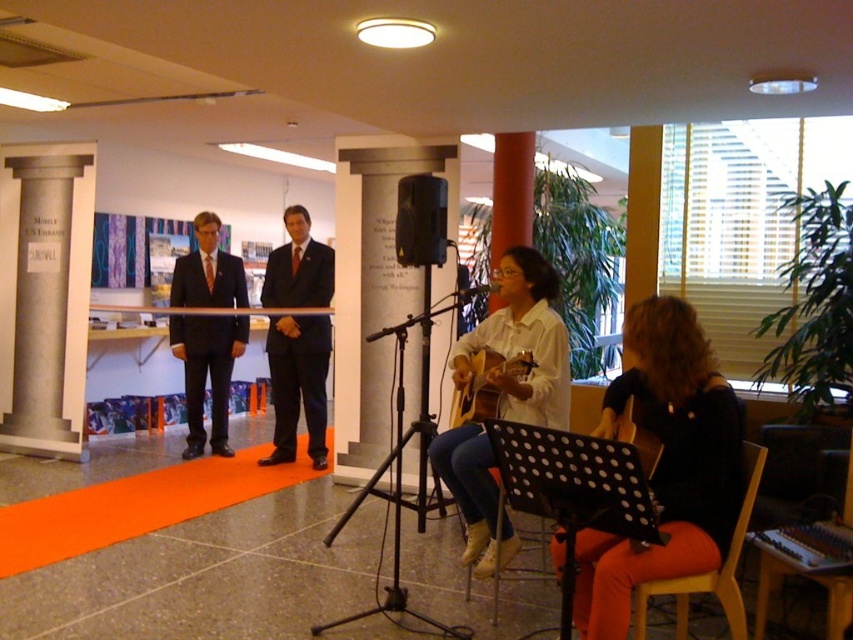
You are organizing a small concert in the hall. You need to place a new amplifier that is 1.2 meters wide between the dark blue suit at center and the wooden acoustic guitar at center. Is there enough space between them to fit the amplifier?

The dark blue suit at center is larger in size than the wooden acoustic guitar at center, but the description does not provide the exact distance between them. Therefore, it is impossible to determine if the amplifier will fit based on the given information.